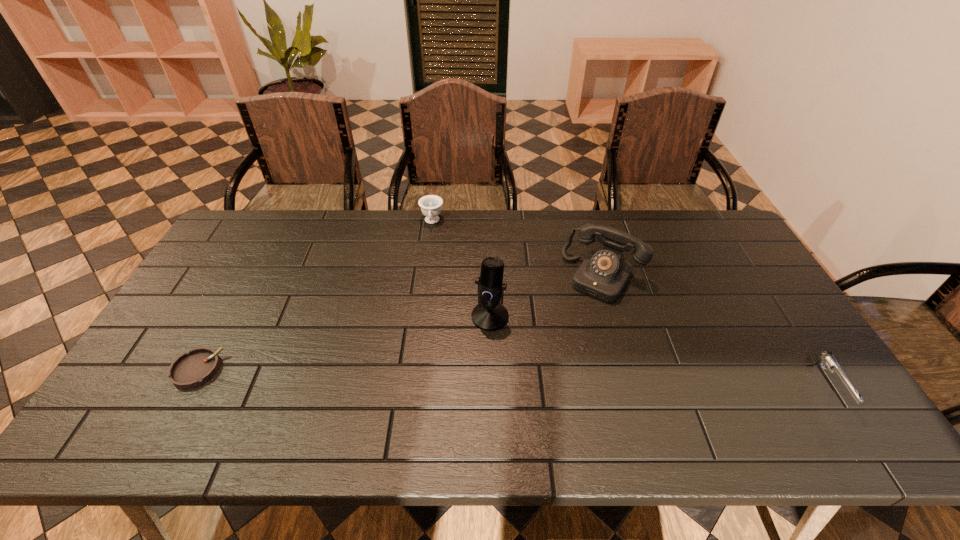
You are a GUI agent. You are given a task and a screenshot of the screen. Output one action in this format:
    pyautogui.click(x=<x>, y=<y>)
    Task: Click on the empty space that is in between the second object from left to right and the shortest object
    The height and width of the screenshot is (540, 960).
    Given the screenshot: What is the action you would take?
    pyautogui.click(x=315, y=296)

This screenshot has height=540, width=960. I want to click on free space between the rightmost object and the second object from right to left, so click(715, 330).

Locate an element on the screen. The height and width of the screenshot is (540, 960). vacant space in between the second object from left to right and the ashtray is located at coordinates (315, 296).

Locate an element on the screen. The width and height of the screenshot is (960, 540). object identified as the second closest to the pistol is located at coordinates (489, 315).

Identify which object is located as the third nearest to the second object from left to right. Please provide its 2D coordinates. Your answer should be formatted as a tuple, i.e. [(x, y)], where the tuple contains the x and y coordinates of a point satisfying the conditions above.

[(195, 368)]